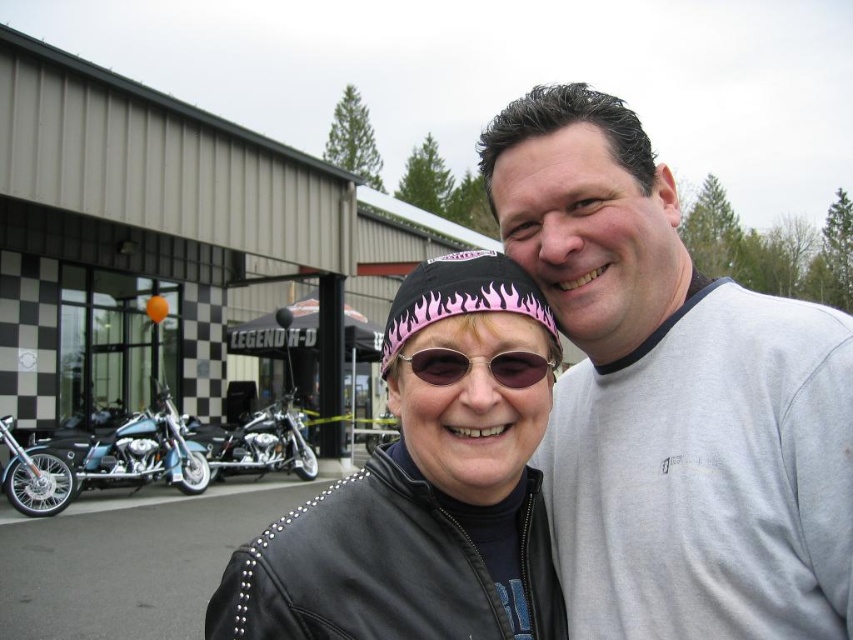
Is point (199, 452) farther from camera compared to point (216, 477)?

No.

Between point (109, 477) and point (288, 436), which one is positioned behind?

The point (288, 436) is more distant.

I want to click on teal metallic motorcycle at left, so click(x=137, y=452).

Measure the distance between pink fabric headscarf at center and chrome metallic motorcycle at center.

pink fabric headscarf at center is 14.74 meters from chrome metallic motorcycle at center.

Which is more to the left, pink fabric headscarf at center or chrome metallic motorcycle at center?

chrome metallic motorcycle at center is more to the left.

Which is in front, point (428, 296) or point (268, 451)?

Point (428, 296) is more forward.

This screenshot has height=640, width=853. Identify the location of pink fabric headscarf at center. (462, 298).

Can you confirm if gray cotton t-shirt at upper right is shorter than pink fabric headscarf at center?

No.

Is point (724, 444) positioned after point (544, 305)?

That is False.

Where is `gray cotton t-shirt at upper right`? This screenshot has height=640, width=853. gray cotton t-shirt at upper right is located at coordinates (672, 397).